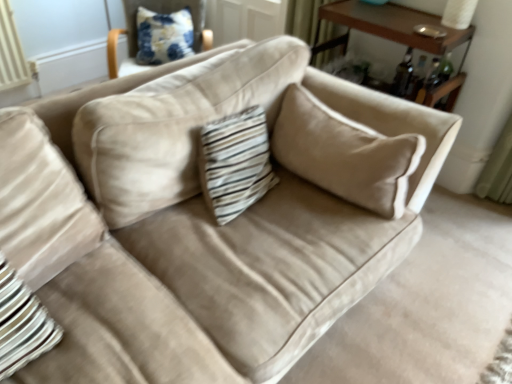
Question: Considering the positions of brown wood table at upper right and white paper lampshade at upper right in the image, is brown wood table at upper right taller or shorter than white paper lampshade at upper right?

Choices:
 (A) short
 (B) tall

Answer: (B)

Question: In terms of size, does brown wood table at upper right appear bigger or smaller than white paper lampshade at upper right?

Choices:
 (A) small
 (B) big

Answer: (B)

Question: Based on their relative distances, which object is farther from the white paper lampshade at upper right?

Choices:
 (A) brown wood table at upper right
 (B) blue printed fabric pillow at upper left

Answer: (B)

Question: Which object is positioned farthest from the white paper lampshade at upper right?

Choices:
 (A) blue printed fabric pillow at upper left
 (B) brown wood table at upper right

Answer: (A)